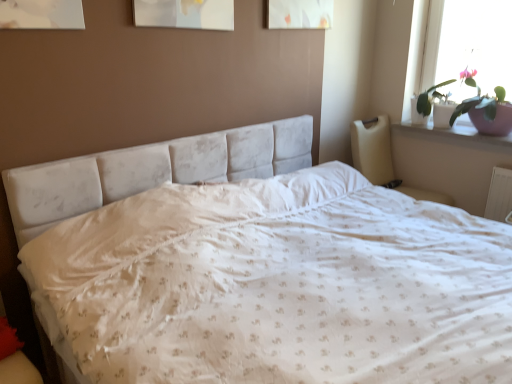
Question: Looking at their shapes, would you say beige fabric armchair at right is wider or thinner than white velvety bed at center?

Choices:
 (A) wide
 (B) thin

Answer: (B)

Question: Is beige fabric armchair at right bigger or smaller than white velvety bed at center?

Choices:
 (A) small
 (B) big

Answer: (A)

Question: Estimate the real-world distances between objects in this image. Which object is closer to the white velvety bed at center?

Choices:
 (A) white glossy window sill at upper right
 (B) beige fabric armchair at right
 (C) pink ceramic pot at upper right

Answer: (B)

Question: Which object is positioned closest to the pink ceramic pot at upper right?

Choices:
 (A) white velvety bed at center
 (B) white glossy window sill at upper right
 (C) beige fabric armchair at right

Answer: (B)